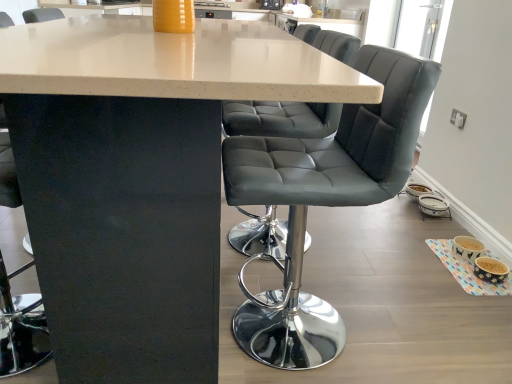
Measure the distance between point (376, 142) and camera.

Point (376, 142) is 1.08 meters from camera.

Describe the element at coordinates (323, 200) in the screenshot. I see `matte gray leather chair at center` at that location.

Where is `matte gray leather chair at center`? The image size is (512, 384). matte gray leather chair at center is located at coordinates (323, 200).

Measure the distance between matte white table at center and camera.

matte white table at center and camera are 25.24 inches apart.

Describe the element at coordinates (140, 177) in the screenshot. I see `matte white table at center` at that location.

Identify the location of matte white table at center. (140, 177).

At what (x,y) coordinates should I click in order to perform the action: click on matte gray leather chair at center. Please return your answer as a coordinate pair (x, y). This screenshot has height=384, width=512. Looking at the image, I should click on click(x=323, y=200).

Based on their positions, is matte white table at center located to the left or right of matte gray leather chair at center?

Clearly, matte white table at center is on the left of matte gray leather chair at center in the image.

Does matte white table at center lie behind matte gray leather chair at center?

No, the depth of matte white table at center is less than that of matte gray leather chair at center.

Considering the positions of point (62, 47) and point (330, 342), is point (62, 47) closer or farther from the camera than point (330, 342)?

Point (62, 47).

From the image's perspective, which one is positioned higher, matte white table at center or matte gray leather chair at center?

matte white table at center appears higher in the image.

From a real-world perspective, between matte white table at center and matte gray leather chair at center, who is vertically higher?

From a 3D spatial view, matte gray leather chair at center is above.

Which object is thinner, matte white table at center or matte gray leather chair at center?

Thinner between the two is matte gray leather chair at center.

Considering the sizes of objects matte white table at center and matte gray leather chair at center in the image provided, who is taller, matte white table at center or matte gray leather chair at center?

Standing taller between the two is matte white table at center.

Consider the image. Considering the sizes of objects matte white table at center and matte gray leather chair at center in the image provided, who is smaller, matte white table at center or matte gray leather chair at center?

Smaller between the two is matte gray leather chair at center.

Would you say matte white table at center contains matte gray leather chair at center?

Yes, matte gray leather chair at center is inside matte white table at center.

Is matte white table at center beside matte gray leather chair at center?

No, matte white table at center is not beside matte gray leather chair at center.

Does matte white table at center turn towards matte gray leather chair at center?

No, matte white table at center does not turn towards matte gray leather chair at center.

Locate an element on the screen. The width and height of the screenshot is (512, 384). chair that is behind the matte white table at center is located at coordinates (323, 200).

Between matte gray leather chair at center and matte white table at center, which one appears on the left side from the viewer's perspective?

From the viewer's perspective, matte white table at center appears more on the left side.

Is matte gray leather chair at center further to camera compared to matte white table at center?

That is True.

Considering the points (344, 340) and (0, 57), which point is in front, point (344, 340) or point (0, 57)?

The point (0, 57) is closer.

From the image's perspective, which one is positioned higher, matte gray leather chair at center or matte white table at center?

matte white table at center, from the image's perspective.

From a real-world perspective, which object stands above the other?

From a 3D spatial view, matte gray leather chair at center is above.

Which object is thinner, matte gray leather chair at center or matte white table at center?

Thinner between the two is matte gray leather chair at center.

Can you confirm if matte gray leather chair at center is shorter than matte white table at center?

Yes.

In terms of size, does matte gray leather chair at center appear bigger or smaller than matte white table at center?

Considering their sizes, matte gray leather chair at center takes up less space than matte white table at center.

In the scene shown: Is matte gray leather chair at center outside of matte white table at center?

No, most part of matte gray leather chair at center lies within matte white table at center.

Are matte gray leather chair at center and matte white table at center far apart?

Actually, matte gray leather chair at center and matte white table at center are a little close together.

Does matte gray leather chair at center turn towards matte white table at center?

Yes, matte gray leather chair at center is turned towards matte white table at center.

The width and height of the screenshot is (512, 384). I want to click on table that is under the matte gray leather chair at center (from a real-world perspective), so click(140, 177).

Where is `table on the left of matte gray leather chair at center`? Image resolution: width=512 pixels, height=384 pixels. table on the left of matte gray leather chair at center is located at coordinates (140, 177).

Where is `table in front of the matte gray leather chair at center`? The height and width of the screenshot is (384, 512). table in front of the matte gray leather chair at center is located at coordinates (140, 177).